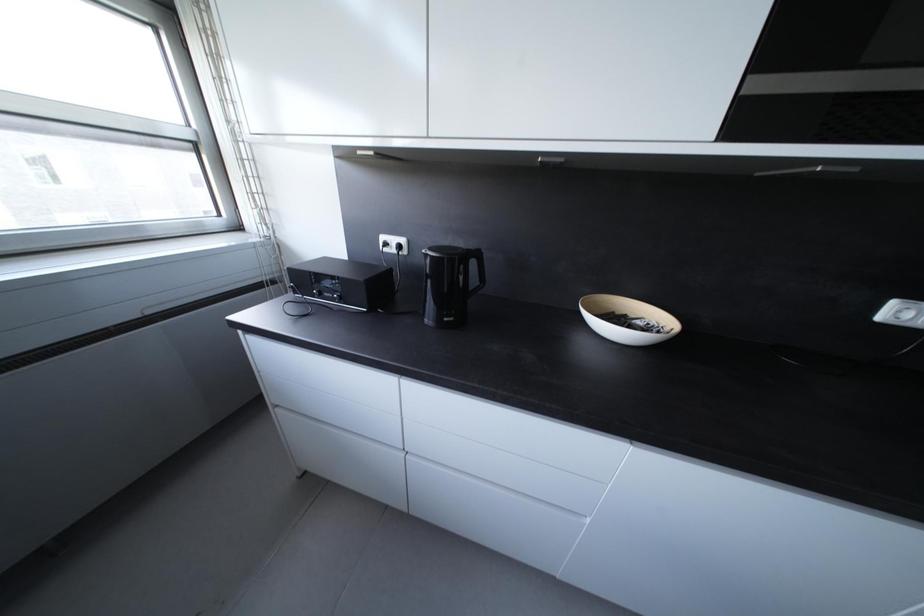
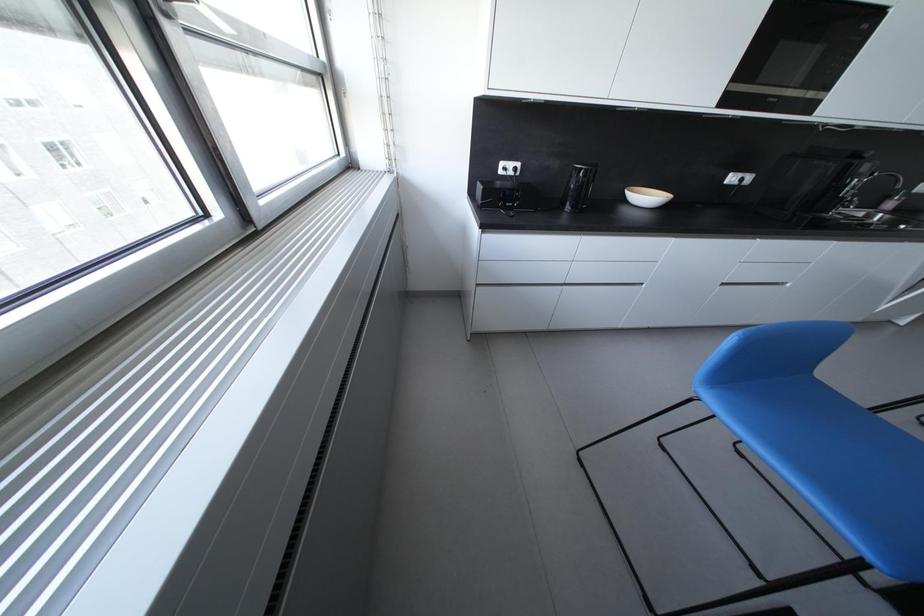
Question: The images are taken continuously from a first-person perspective. In which direction are you moving?

Choices:
 (A) Left
 (B) Right
 (C) Forward
 (D) Backward

Answer: (A)